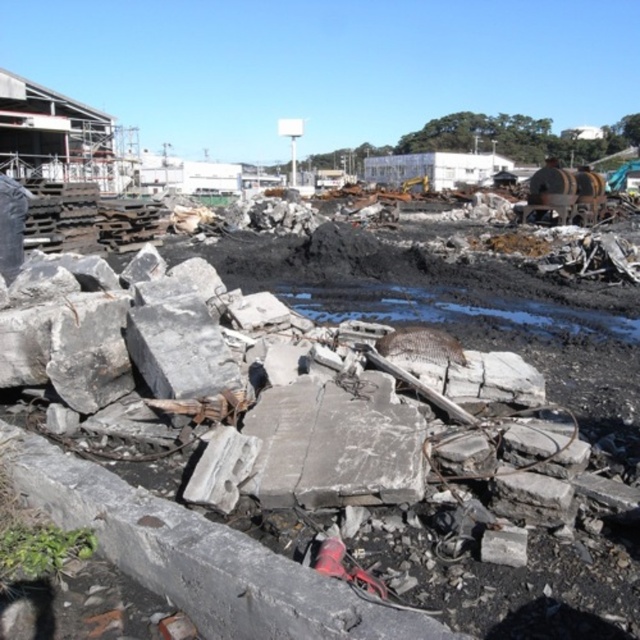
Question: Is gray concrete rubble at center to the left of gray concrete block at center from the viewer's perspective?

Choices:
 (A) yes
 (B) no

Answer: (B)

Question: Can you confirm if gray concrete rubble at center is positioned above gray concrete block at center?

Choices:
 (A) no
 (B) yes

Answer: (A)

Question: Which object appears farthest from the camera in this image?

Choices:
 (A) gray concrete rubble at center
 (B) gray concrete block at center

Answer: (B)

Question: Observing the image, what is the correct spatial positioning of gray concrete rubble at center in reference to gray concrete block at center?

Choices:
 (A) right
 (B) left

Answer: (A)